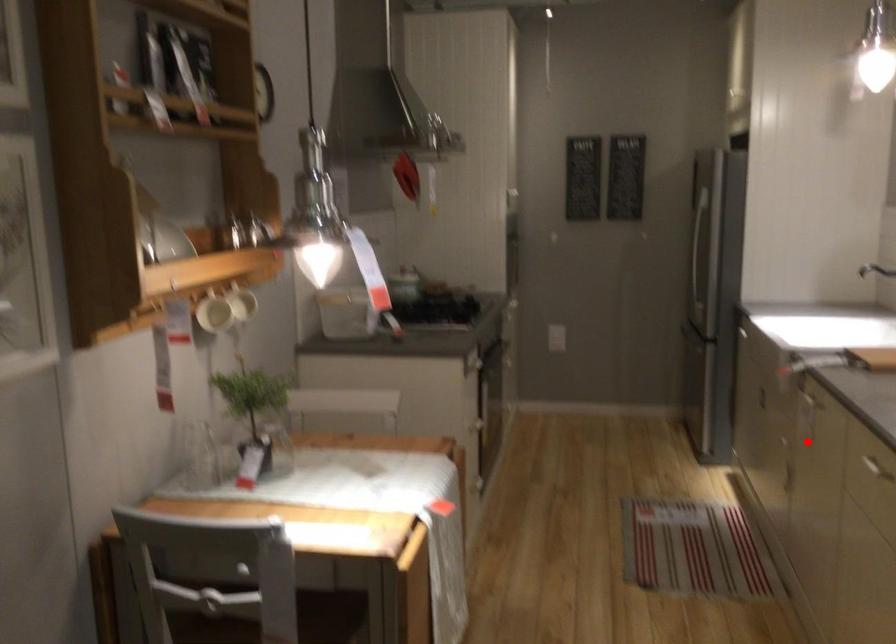
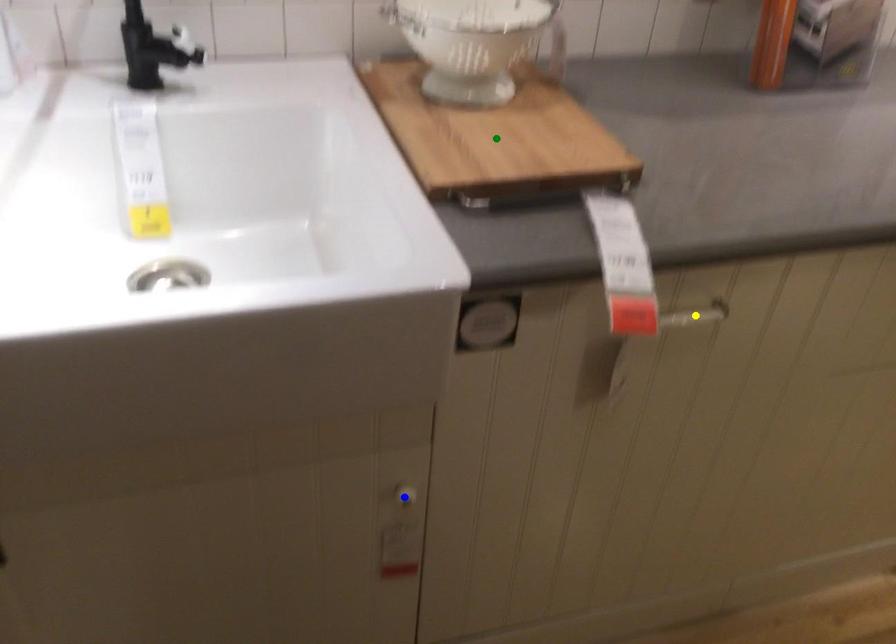
Question: I am providing you with two images of the same scene from different viewpoints. A red point is marked on the first image. You are given multiple points on the second image. Which mark in image 2 goes with the point in image 1?

Choices:
 (A) blue point
 (B) green point
 (C) yellow point

Answer: (A)